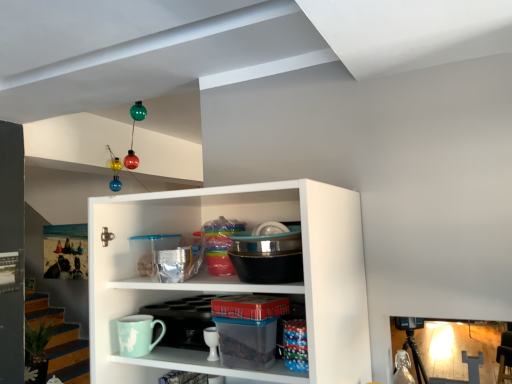
Question: From a real-world perspective, is mint matte mug at lower center on top of clear plastic container at center?

Choices:
 (A) yes
 (B) no

Answer: (B)

Question: Is clear plastic container at center at the back of mint matte mug at lower center?

Choices:
 (A) yes
 (B) no

Answer: (B)

Question: Is mint matte mug at lower center positioned far away from clear plastic container at center?

Choices:
 (A) yes
 (B) no

Answer: (B)

Question: Considering the relative positions of mint matte mug at lower center and clear plastic container at center in the image provided, is mint matte mug at lower center to the left of clear plastic container at center from the viewer's perspective?

Choices:
 (A) yes
 (B) no

Answer: (A)

Question: Is mint matte mug at lower center completely or partially outside of clear plastic container at center?

Choices:
 (A) yes
 (B) no

Answer: (A)

Question: Is mint matte mug at lower center smaller than clear plastic container at center?

Choices:
 (A) yes
 (B) no

Answer: (A)

Question: Considering the relative sizes of clear plastic container at center and mint matte mug at lower center in the image provided, is clear plastic container at center shorter than mint matte mug at lower center?

Choices:
 (A) no
 (B) yes

Answer: (A)

Question: Is clear plastic container at center wider than mint matte mug at lower center?

Choices:
 (A) no
 (B) yes

Answer: (B)

Question: Does clear plastic container at center appear on the right side of mint matte mug at lower center?

Choices:
 (A) no
 (B) yes

Answer: (B)

Question: Does clear plastic container at center have a greater height compared to mint matte mug at lower center?

Choices:
 (A) yes
 (B) no

Answer: (A)

Question: From the image's perspective, is clear plastic container at center over mint matte mug at lower center?

Choices:
 (A) no
 (B) yes

Answer: (B)

Question: Is clear plastic container at center bigger than mint matte mug at lower center?

Choices:
 (A) no
 (B) yes

Answer: (B)

Question: In terms of height, does clear plastic container at center look taller or shorter compared to mint matte mug at lower center?

Choices:
 (A) tall
 (B) short

Answer: (A)